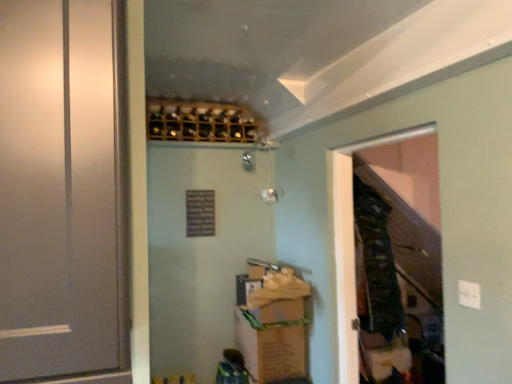
Question: From their relative heights in the image, would you say white matte door at left is taller or shorter than brown cardboard box at lower center?

Choices:
 (A) tall
 (B) short

Answer: (A)

Question: In the image, is white matte door at left on the left side or the right side of brown cardboard box at lower center?

Choices:
 (A) right
 (B) left

Answer: (B)

Question: Which object is positioned closest to the camouflage fabric laundry at right?

Choices:
 (A) wooden screen door at right
 (B) wooden wine rack at upper center
 (C) brown cardboard box at lower center
 (D) white matte door at left

Answer: (A)

Question: Which of these objects is positioned farthest from the wooden screen door at right?

Choices:
 (A) camouflage fabric laundry at right
 (B) brown cardboard box at lower center
 (C) white matte door at left
 (D) wooden wine rack at upper center

Answer: (C)